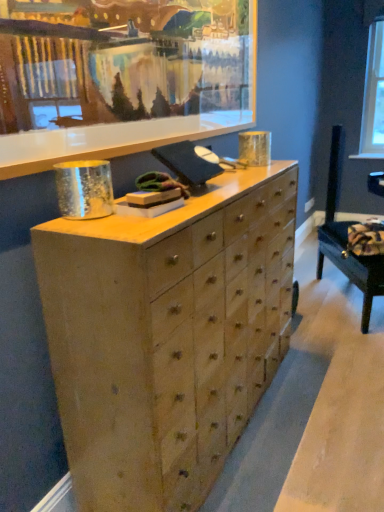
Image resolution: width=384 pixels, height=512 pixels. Identify the location of wooden picture frame at upper center. tap(123, 79).

Describe the element at coordinates (123, 79) in the screenshot. I see `wooden picture frame at upper center` at that location.

What are the coordinates of `clear glass window screen at upper right` in the screenshot? It's located at (373, 95).

This screenshot has width=384, height=512. Identify the location of natural wood chest of drawers at center. (167, 336).

How different are the orientations of velvet dark blue swivel chair at lower right and clear glass window screen at upper right in degrees?

121 degrees separate the facing orientations of velvet dark blue swivel chair at lower right and clear glass window screen at upper right.

Consider the image. Considering the positions of objects velvet dark blue swivel chair at lower right and clear glass window screen at upper right in the image provided, who is in front, velvet dark blue swivel chair at lower right or clear glass window screen at upper right?

velvet dark blue swivel chair at lower right is more forward.

Is velvet dark blue swivel chair at lower right facing away from clear glass window screen at upper right?

No.

Does velvet dark blue swivel chair at lower right have a greater width compared to clear glass window screen at upper right?

Yes.

Identify the location of the chest of drawers lying below the velvet dark blue swivel chair at lower right (from the image's perspective). (167, 336).

Consider the image. From a real-world perspective, is velvet dark blue swivel chair at lower right on top of natural wood chest of drawers at center?

No, from a real-world perspective, velvet dark blue swivel chair at lower right is not above natural wood chest of drawers at center.

Can you see velvet dark blue swivel chair at lower right touching natural wood chest of drawers at center?

No, velvet dark blue swivel chair at lower right is not next to natural wood chest of drawers at center.

Who is bigger, natural wood chest of drawers at center or clear glass window screen at upper right?

Bigger between the two is natural wood chest of drawers at center.

The height and width of the screenshot is (512, 384). I want to click on window screen located above the natural wood chest of drawers at center (from a real-world perspective), so click(373, 95).

Is natural wood chest of drawers at center turned away from clear glass window screen at upper right?

No, clear glass window screen at upper right is not at the back of natural wood chest of drawers at center.

Which is behind, clear glass window screen at upper right or velvet dark blue swivel chair at lower right?

clear glass window screen at upper right is more distant.

Which object is positioned more to the left, clear glass window screen at upper right or velvet dark blue swivel chair at lower right?

From the viewer's perspective, velvet dark blue swivel chair at lower right appears more on the left side.

Considering the sizes of objects clear glass window screen at upper right and velvet dark blue swivel chair at lower right in the image provided, who is bigger, clear glass window screen at upper right or velvet dark blue swivel chair at lower right?

velvet dark blue swivel chair at lower right is bigger.

Considering the relative sizes of clear glass window screen at upper right and velvet dark blue swivel chair at lower right in the image provided, is clear glass window screen at upper right wider than velvet dark blue swivel chair at lower right?

In fact, clear glass window screen at upper right might be narrower than velvet dark blue swivel chair at lower right.

At what (x,y) coordinates should I click in order to perform the action: click on window screen that appears behind the wooden picture frame at upper center. Please return your answer as a coordinate pair (x, y). This screenshot has width=384, height=512. Looking at the image, I should click on (373, 95).

Between wooden picture frame at upper center and clear glass window screen at upper right, which one appears on the left side from the viewer's perspective?

Positioned to the left is wooden picture frame at upper center.

Based on their sizes in the image, would you say wooden picture frame at upper center is bigger or smaller than clear glass window screen at upper right?

Considering their sizes, wooden picture frame at upper center takes up more space than clear glass window screen at upper right.

Which point is more distant from viewer, [97,89] or [382,86]?

The point [382,86] is behind.

Considering the relative positions of wooden picture frame at upper center and natural wood chest of drawers at center in the image provided, is wooden picture frame at upper center to the left of natural wood chest of drawers at center from the viewer's perspective?

Indeed, wooden picture frame at upper center is positioned on the left side of natural wood chest of drawers at center.

Which is behind, point (59, 73) or point (128, 347)?

Positioned behind is point (59, 73).

Which is behind, wooden picture frame at upper center or natural wood chest of drawers at center?

natural wood chest of drawers at center is further from the camera.

Is natural wood chest of drawers at center turned away from wooden picture frame at upper center?

No, natural wood chest of drawers at center is not facing away from wooden picture frame at upper center.

Based on their positions, is natural wood chest of drawers at center located to the left or right of wooden picture frame at upper center?

From the image, it's evident that natural wood chest of drawers at center is to the right of wooden picture frame at upper center.

From the image's perspective, is natural wood chest of drawers at center over wooden picture frame at upper center?

Actually, natural wood chest of drawers at center appears below wooden picture frame at upper center in the image.

Is natural wood chest of drawers at center placed right next to wooden picture frame at upper center?

No, natural wood chest of drawers at center is not making contact with wooden picture frame at upper center.

This screenshot has height=512, width=384. What are the coordinates of `swivel chair that appears on the left of clear glass window screen at upper right` in the screenshot? It's located at (346, 240).

At what (x,y) coordinates should I click in order to perform the action: click on chest of drawers in front of the velvet dark blue swivel chair at lower right. Please return your answer as a coordinate pair (x, y). This screenshot has width=384, height=512. Looking at the image, I should click on (167, 336).

Estimate the real-world distances between objects in this image. Which object is further from wooden picture frame at upper center, velvet dark blue swivel chair at lower right or clear glass window screen at upper right?

clear glass window screen at upper right is further to wooden picture frame at upper center.

From the image, which object appears to be farther from wooden picture frame at upper center, clear glass window screen at upper right or natural wood chest of drawers at center?

clear glass window screen at upper right is positioned further to the anchor wooden picture frame at upper center.

Considering their positions, is clear glass window screen at upper right positioned further to natural wood chest of drawers at center than velvet dark blue swivel chair at lower right?

Among the two, clear glass window screen at upper right is located further to natural wood chest of drawers at center.

From the image, which object appears to be nearer to velvet dark blue swivel chair at lower right, clear glass window screen at upper right or wooden picture frame at upper center?

Among the two, wooden picture frame at upper center is located nearer to velvet dark blue swivel chair at lower right.

Based on the photo, based on their spatial positions, is velvet dark blue swivel chair at lower right or clear glass window screen at upper right further from natural wood chest of drawers at center?

clear glass window screen at upper right is positioned further to the anchor natural wood chest of drawers at center.

Considering their positions, is natural wood chest of drawers at center positioned closer to wooden picture frame at upper center than velvet dark blue swivel chair at lower right?

The object closer to wooden picture frame at upper center is natural wood chest of drawers at center.

Based on their spatial positions, is natural wood chest of drawers at center or velvet dark blue swivel chair at lower right further from clear glass window screen at upper right?

natural wood chest of drawers at center.

Considering their positions, is natural wood chest of drawers at center positioned further to velvet dark blue swivel chair at lower right than wooden picture frame at upper center?

Based on the image, wooden picture frame at upper center appears to be further to velvet dark blue swivel chair at lower right.

Identify the location of the chest of drawers located between wooden picture frame at upper center and velvet dark blue swivel chair at lower right in the depth direction. (167, 336).

At what (x,y) coordinates should I click in order to perform the action: click on swivel chair located between natural wood chest of drawers at center and clear glass window screen at upper right in the depth direction. Please return your answer as a coordinate pair (x, y). Looking at the image, I should click on (346, 240).

The height and width of the screenshot is (512, 384). In order to click on swivel chair between wooden picture frame at upper center and clear glass window screen at upper right in the front-back direction in this screenshot , I will do `click(346, 240)`.

Find the location of `the chest of drawers positioned between wooden picture frame at upper center and clear glass window screen at upper right from near to far`. the chest of drawers positioned between wooden picture frame at upper center and clear glass window screen at upper right from near to far is located at coordinates (167, 336).